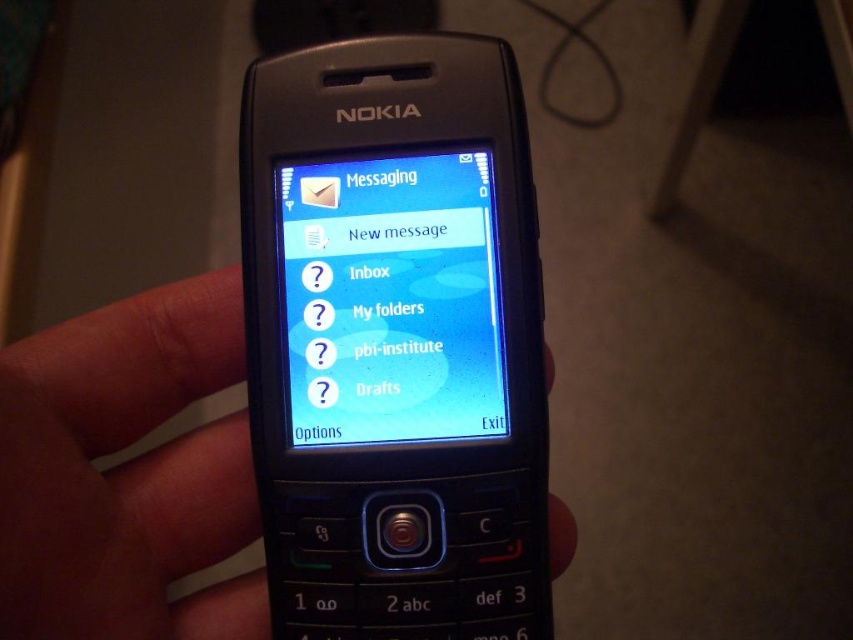
You are trying to send a text message using the phone. The phone has a black plastic phone at center and a blue glossy screen at center. Which part should you look at to see the message interface?

The blue glossy screen at center is where you can see the message interface, as it is located above the black plastic phone at center which contains the physical keypad.

You are trying to navigate the Nokia phone screen. You see two points on the screen at coordinates point (381, 237) and point (311, 426). Which point is closer to the bottom edge of the screen?

Point (381, 237) is behind point (311, 426), so it is closer to the bottom edge of the screen.

You are trying to send a text message using the Nokia mobile phone shown. You notice the black matte phone at center and the blue glossy screen at center. Which object should you interact with to compose a new message?

You should interact with the blue glossy screen at center to compose a new message since the screen displays the messaging interface with options like New message, Inbox, and Drafts, which are necessary for composing messages.